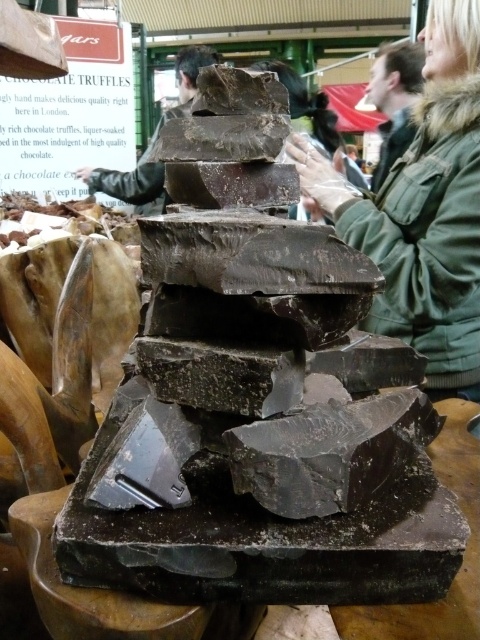
You are standing at the origin point of the coordinate system in the image. You want to move towards the point labeled as point (384, 109). However, there is an obstacle at point (187, 72). Will you encounter the obstacle before reaching your destination?

Since point (384, 109) is in front of point (187, 72), you will reach point (384, 109) before encountering the obstacle at point (187, 72).

You are standing at the entrance of the indoor market and notice a green wool jacket at upper right and dark chocolate at center. Which object is closer to you?

The green wool jacket at upper right is closer to you because it is in front of the dark chocolate at center.

You are a photographer standing at the edge of the scene. You want to take a photo that includes both the green fuzzy coat at upper right and the dark chocolate at center. Which object will appear larger in the photo?

The green fuzzy coat at upper right will appear larger in the photo because it is much taller than the dark chocolate at center.